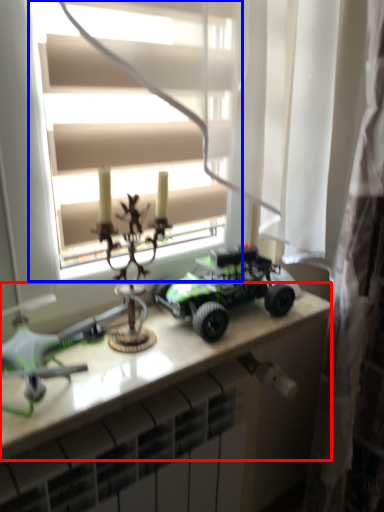
Question: Which of the following is the closest to the observer, table (highlighted by a red box) or window (highlighted by a blue box)?

Choices:
 (A) table
 (B) window

Answer: (B)